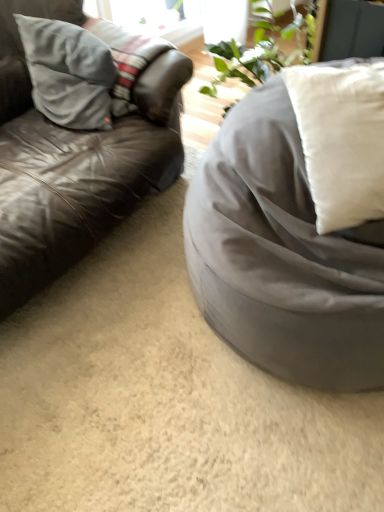
Question: From a real-world perspective, is satin gray bean bag at right physically above white soft cushion at right, which is the second pillow from back to front?

Choices:
 (A) yes
 (B) no

Answer: (B)

Question: From the image's perspective, is satin gray bean bag at right on top of white soft cushion at right, positioned as the 1th pillow in right-to-left order?

Choices:
 (A) no
 (B) yes

Answer: (A)

Question: Is satin gray bean bag at right next to white soft cushion at right, which is the second pillow from back to front, and touching it?

Choices:
 (A) no
 (B) yes

Answer: (A)

Question: Can you confirm if satin gray bean bag at right is positioned to the left of white soft cushion at right, positioned as the 1th pillow in right-to-left order?

Choices:
 (A) yes
 (B) no

Answer: (A)

Question: Is satin gray bean bag at right far from white soft cushion at right, which is the second pillow from left to right?

Choices:
 (A) no
 (B) yes

Answer: (A)

Question: Is satin gray bean bag at right to the right of white soft cushion at right, positioned as the 1th pillow in right-to-left order, from the viewer's perspective?

Choices:
 (A) no
 (B) yes

Answer: (A)

Question: Considering the relative sizes of leather couch at left and suede gray pillow at left, the 2th pillow from the right, in the image provided, is leather couch at left thinner than suede gray pillow at left, the 2th pillow from the right,?

Choices:
 (A) no
 (B) yes

Answer: (A)

Question: Is leather couch at left further to camera compared to suede gray pillow at left, the 2th pillow from the right?

Choices:
 (A) no
 (B) yes

Answer: (A)

Question: Can you confirm if leather couch at left is wider than suede gray pillow at left, the second pillow when ordered from front to back?

Choices:
 (A) yes
 (B) no

Answer: (A)

Question: Is leather couch at left looking in the opposite direction of suede gray pillow at left, the second pillow when ordered from front to back?

Choices:
 (A) no
 (B) yes

Answer: (B)

Question: From the image's perspective, is leather couch at left located above suede gray pillow at left, the second pillow when ordered from front to back?

Choices:
 (A) yes
 (B) no

Answer: (B)

Question: Does leather couch at left have a larger size compared to suede gray pillow at left, the 1th pillow positioned from the left?

Choices:
 (A) yes
 (B) no

Answer: (A)

Question: Are white soft cushion at right, which is the second pillow from left to right, and suede gray pillow at left, the 1th pillow viewed from the back, located far from each other?

Choices:
 (A) yes
 (B) no

Answer: (B)